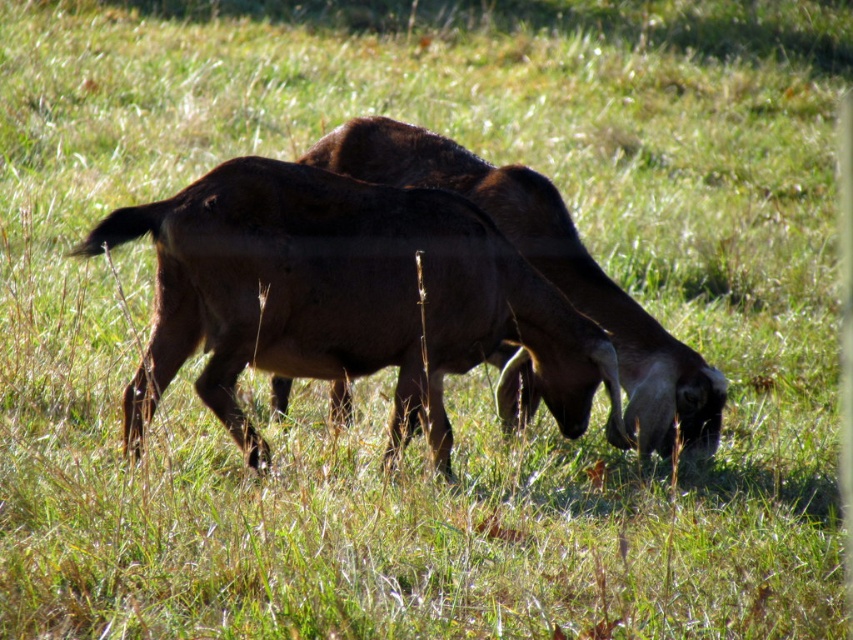
Question: Considering the relative positions of brown rough fur goat at center and brown matte goat at center in the image provided, where is brown rough fur goat at center located with respect to brown matte goat at center?

Choices:
 (A) above
 (B) below

Answer: (B)

Question: Among these objects, which one is nearest to the camera?

Choices:
 (A) brown matte goat at center
 (B) brown rough fur goat at center

Answer: (B)

Question: Which point appears closest to the camera in this image?

Choices:
 (A) (550, 237)
 (B) (595, 365)

Answer: (B)

Question: Does brown rough fur goat at center come behind brown matte goat at center?

Choices:
 (A) no
 (B) yes

Answer: (A)

Question: Does brown rough fur goat at center have a lesser width compared to brown matte goat at center?

Choices:
 (A) yes
 (B) no

Answer: (B)